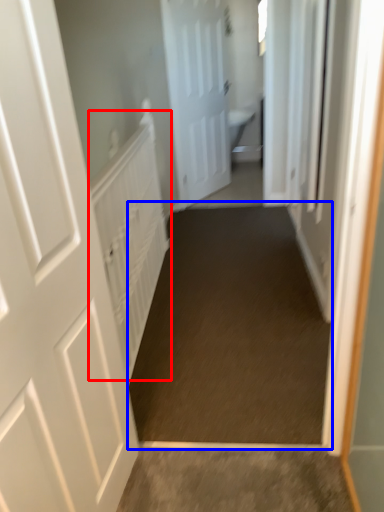
Question: Which object is further to the camera taking this photo, radiator (highlighted by a red box) or path (highlighted by a blue box)?

Choices:
 (A) radiator
 (B) path

Answer: (A)